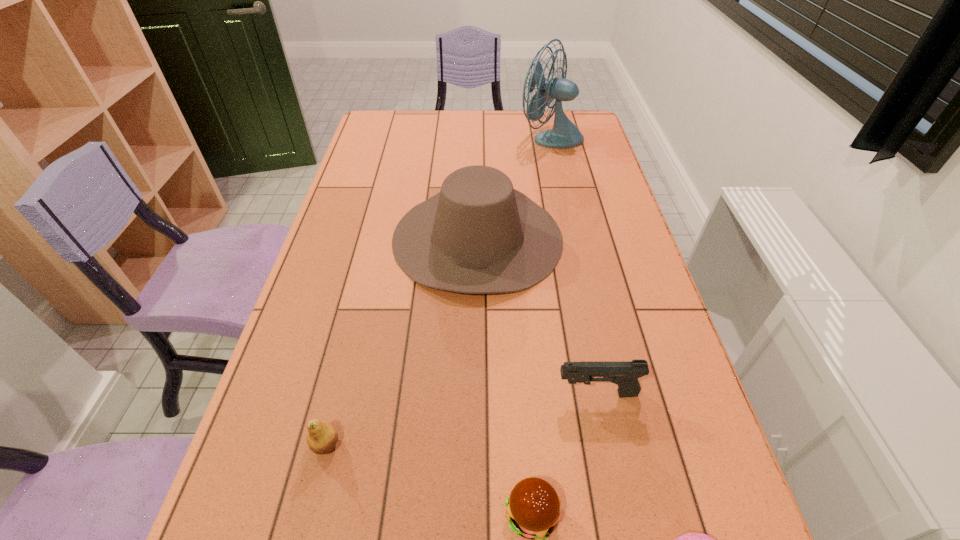
In the image, there is a desktop. Where is `free space at the far edge`? free space at the far edge is located at coordinates (519, 123).

In the image, there is a desktop. Where is `blank space at the left edge`? blank space at the left edge is located at coordinates (372, 256).

Image resolution: width=960 pixels, height=540 pixels. I want to click on free location at the right edge of the desktop, so click(x=607, y=184).

The image size is (960, 540). I want to click on free space at the far left corner of the desktop, so click(378, 116).

Locate an element on the screen. The height and width of the screenshot is (540, 960). empty location between the fan and the second tallest object is located at coordinates (514, 187).

The image size is (960, 540). Find the location of `blank region between the farthest object and the third nearest object`. blank region between the farthest object and the third nearest object is located at coordinates (438, 291).

At what (x,y) coordinates should I click in order to perform the action: click on object that is the fifth closest to the fifth shortest object. Please return your answer as a coordinate pair (x, y). Looking at the image, I should click on (689, 539).

Where is `the third closest object relative to the hamburger`? the third closest object relative to the hamburger is located at coordinates (322, 437).